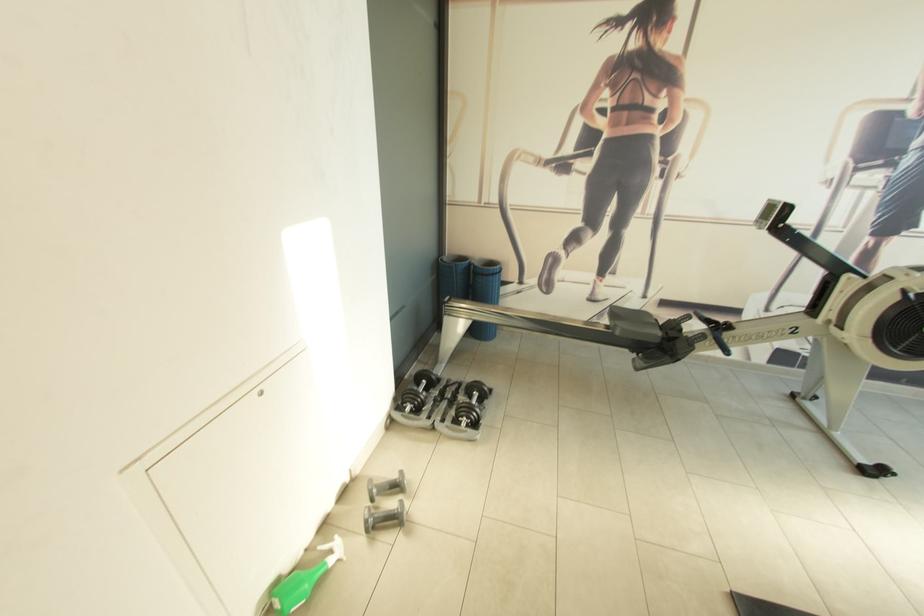
Image resolution: width=924 pixels, height=616 pixels. What are the coordinates of `access panel lock` in the screenshot? It's located at (772, 214).